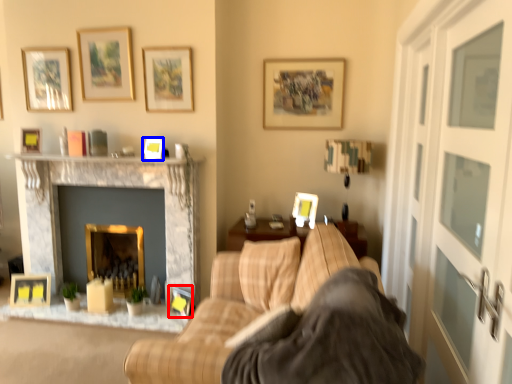
Question: Which of the following is the closest to the observer, picture frame (highlighted by a red box) or picture frame (highlighted by a blue box)?

Choices:
 (A) picture frame
 (B) picture frame

Answer: (B)